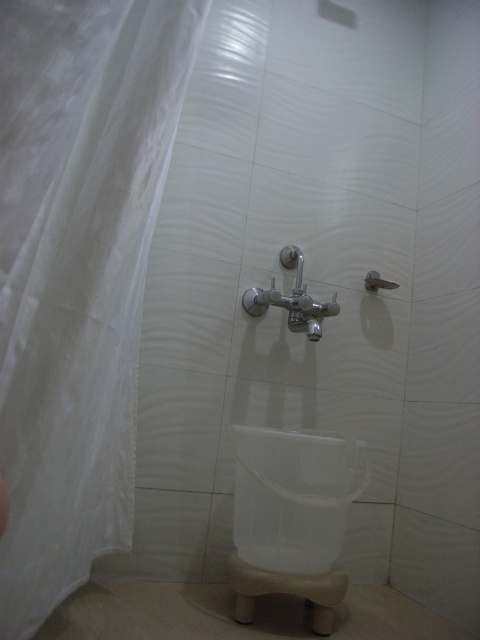
You are standing in the bathroom and want to check the position of the white sheer curtain at left. According to the scene description, can you confirm if the white sheer curtain at left is located at the coordinates point (76, 273)?

Yes, the white sheer curtain at left is located at point (76, 273) as stated in the Objects Description.

You are standing in the bathroom and want to adjust the white sheer curtain at left. To do so, you need to pass by the matte silver shower at upper center. Is the curtain within your reach without moving the shower?

The white sheer curtain at left is closer to the viewer than the matte silver shower at upper center, so you can reach the curtain without moving the shower.

You are standing in the bathroom and want to adjust the white sheer curtain at left. To do so, you need to move around the satin nickel faucet at center. Which direction should you move relative to the faucet to reach the curtain?

The white sheer curtain at left is positioned on the left side of the satin nickel faucet at center, so you should move to the left of the faucet to reach the curtain.